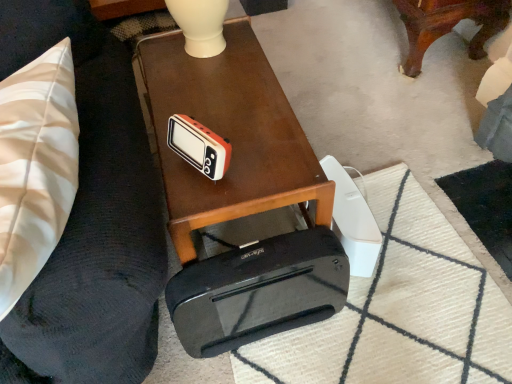
What are the coordinates of `vacant area located to the right-hand side of orange matte clock at center` in the screenshot? It's located at (267, 162).